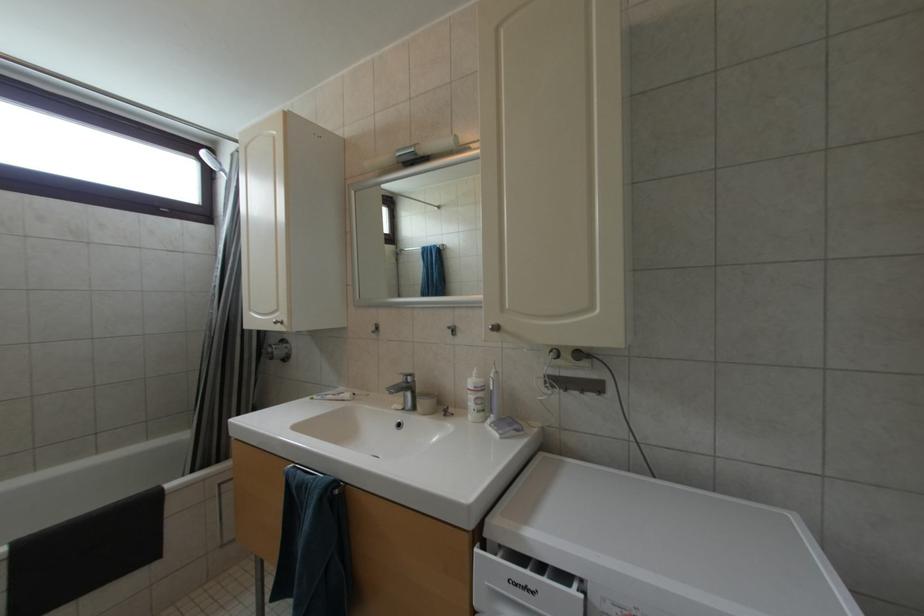
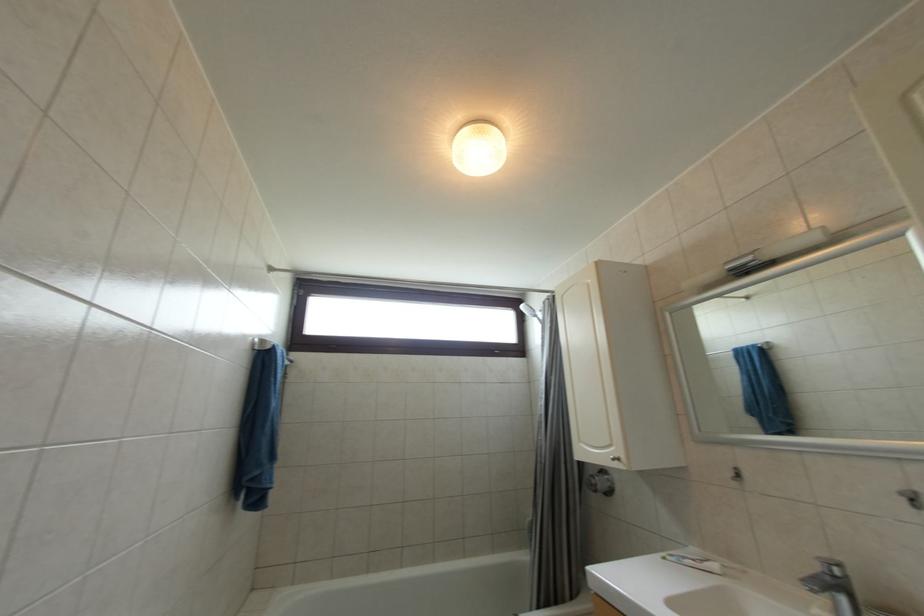
The images are taken continuously from a first-person perspective. In which direction is your viewpoint rotating?

The rotation direction of the camera is left-up.